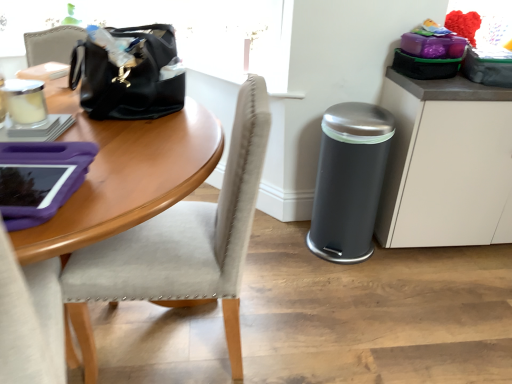
Question: From the image's perspective, is black leather handbag at upper left beneath matte gray cabinet at right?

Choices:
 (A) no
 (B) yes

Answer: (A)

Question: Is black leather handbag at upper left facing towards matte gray cabinet at right?

Choices:
 (A) yes
 (B) no

Answer: (B)

Question: Does black leather handbag at upper left appear on the right side of matte gray cabinet at right?

Choices:
 (A) no
 (B) yes

Answer: (A)

Question: Can you confirm if black leather handbag at upper left is thinner than matte gray cabinet at right?

Choices:
 (A) yes
 (B) no

Answer: (A)

Question: From the image's perspective, is black leather handbag at upper left over matte gray cabinet at right?

Choices:
 (A) no
 (B) yes

Answer: (B)

Question: From their relative heights in the image, would you say matte gray cabinet at right is taller or shorter than light gray fabric chair at left?

Choices:
 (A) tall
 (B) short

Answer: (B)

Question: From the image's perspective, is matte gray cabinet at right above or below light gray fabric chair at left?

Choices:
 (A) below
 (B) above

Answer: (B)

Question: From a real-world perspective, is matte gray cabinet at right positioned above or below light gray fabric chair at left?

Choices:
 (A) below
 (B) above

Answer: (A)

Question: Considering the positions of matte gray cabinet at right and light gray fabric chair at left in the image, is matte gray cabinet at right wider or thinner than light gray fabric chair at left?

Choices:
 (A) wide
 (B) thin

Answer: (B)

Question: Considering the positions of black leather handbag at upper left and light gray fabric chair at left in the image, is black leather handbag at upper left wider or thinner than light gray fabric chair at left?

Choices:
 (A) wide
 (B) thin

Answer: (B)

Question: In terms of height, does black leather handbag at upper left look taller or shorter compared to light gray fabric chair at left?

Choices:
 (A) short
 (B) tall

Answer: (A)

Question: From a real-world perspective, relative to light gray fabric chair at left, is black leather handbag at upper left vertically above or below?

Choices:
 (A) below
 (B) above

Answer: (B)

Question: From the image's perspective, is black leather handbag at upper left positioned above or below light gray fabric chair at left?

Choices:
 (A) below
 (B) above

Answer: (B)

Question: Considering the positions of light gray fabric chair at left and matte gray cabinet at right in the image, is light gray fabric chair at left taller or shorter than matte gray cabinet at right?

Choices:
 (A) short
 (B) tall

Answer: (B)

Question: Is point (157, 226) closer or farther from the camera than point (435, 246)?

Choices:
 (A) closer
 (B) farther

Answer: (A)